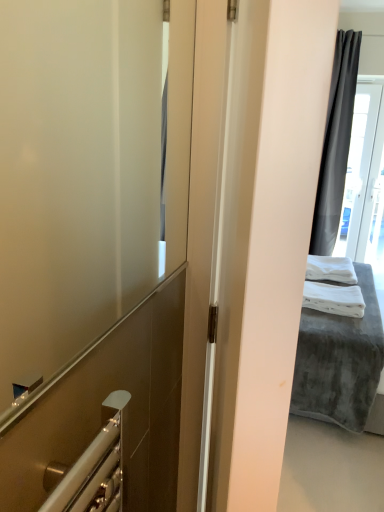
Find the location of a particular element. The width and height of the screenshot is (384, 512). free space in front of white soft towel at right, the first bath towel positioned from the front is located at coordinates (339, 326).